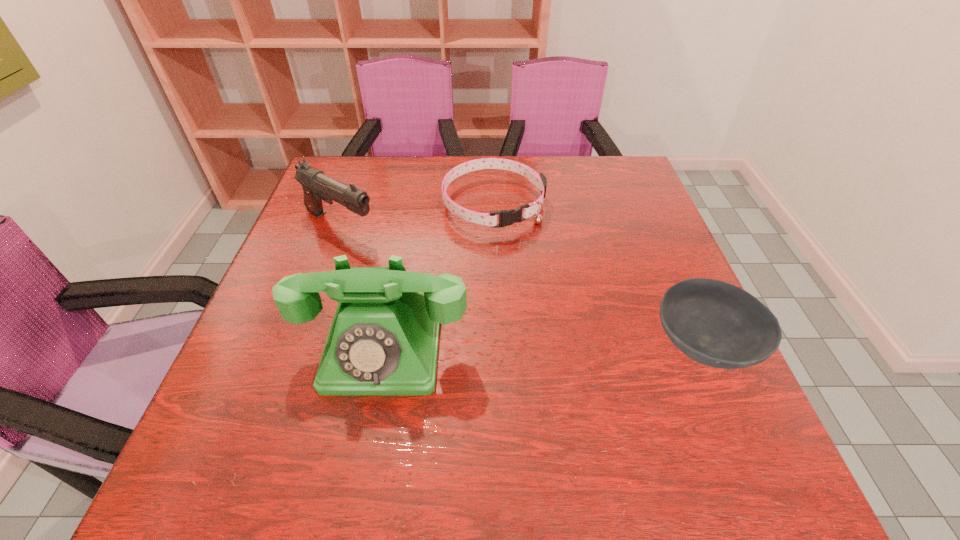
In order to click on free space on the desktop that is between the telephone and the third tallest object and is positioned with the buckle on the dog collar in this screenshot , I will do `click(590, 347)`.

Identify the location of vacant space on the desktop that is between the telephone and the second shortest object and is positioned in the direction the gun is aimed. (568, 347).